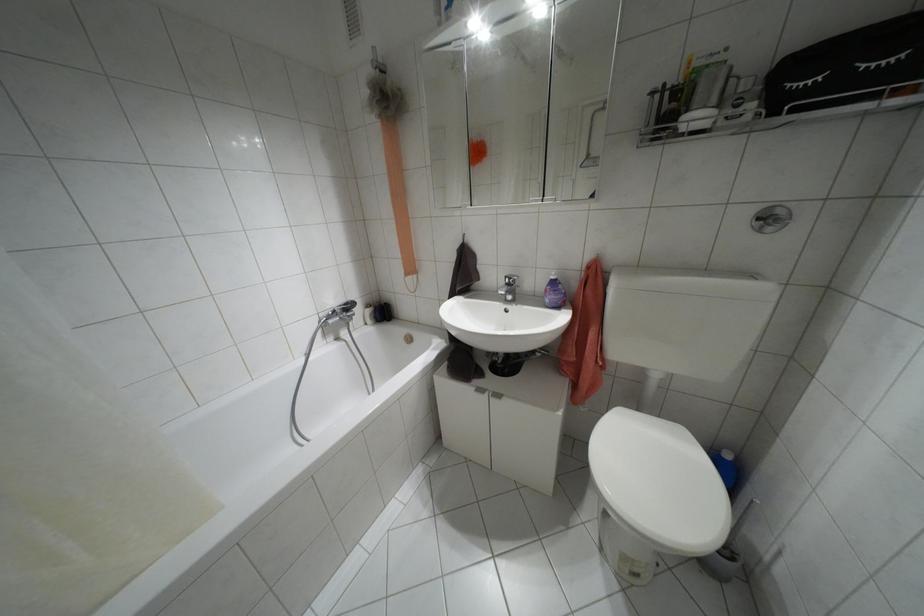
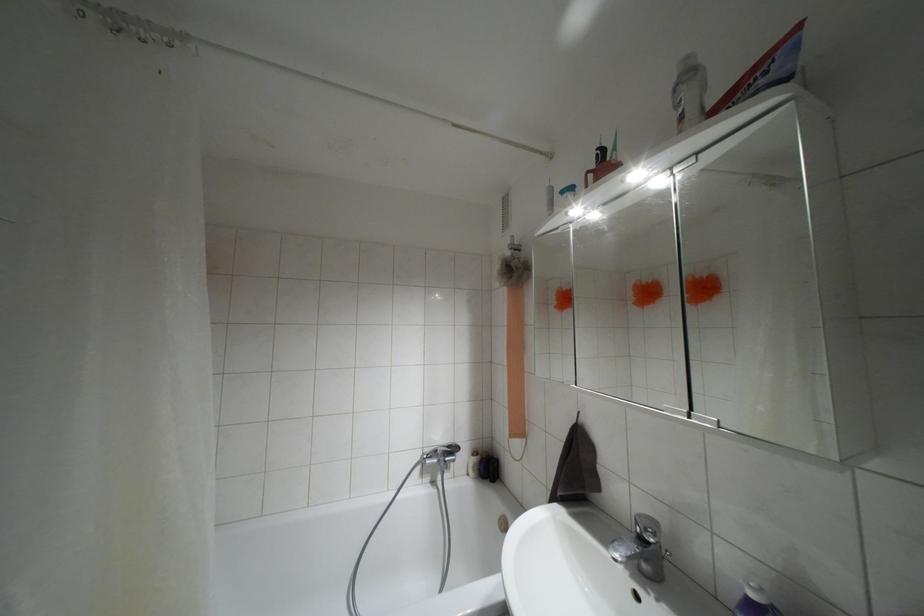
Locate, in the second image, the point that corresponds to (552,277) in the first image.

(751, 594)